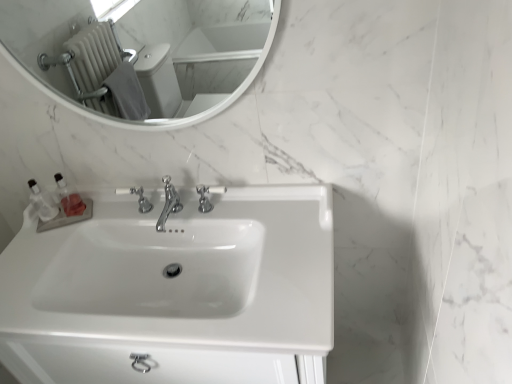
This screenshot has width=512, height=384. In order to click on vacant area that is situated to the right of clear plastic bottles at left, the 1th toiletry from the left in this screenshot , I will do `click(95, 210)`.